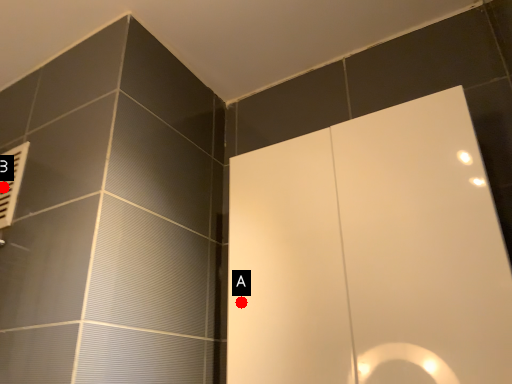
Question: Two points are circled on the image, labeled by A and B beside each circle. Which point is further to the camera?

Choices:
 (A) A is further
 (B) B is further

Answer: (B)